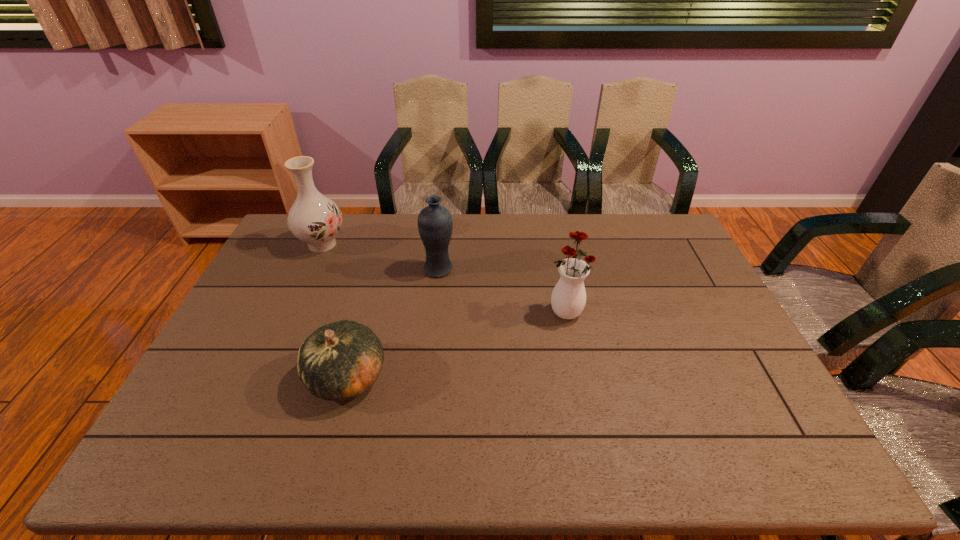
Identify the location of vase that is the second closest to the tallest object. (568, 299).

Identify which vase is the second closest to the second vase from right to left. Please provide its 2D coordinates. Your answer should be formatted as a tuple, i.e. [(x, y)], where the tuple contains the x and y coordinates of a point satisfying the conditions above.

[(568, 299)]

At what (x,y) coordinates should I click in order to perform the action: click on vacant space that satisfies the following two spatial constraints: 1. on the front side of the gourd; 2. on the left side of the leftmost vase. Please return your answer as a coordinate pair (x, y). Looking at the image, I should click on (263, 376).